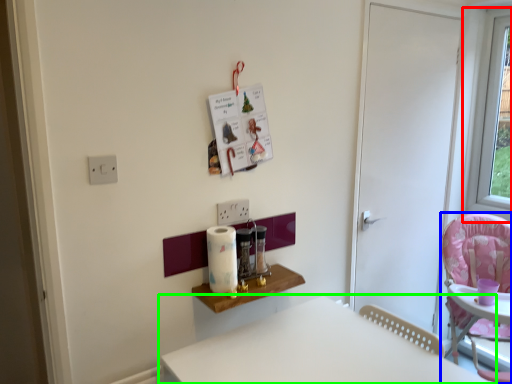
Question: Estimate the real-world distances between objects in this image. Which object is closer to window (highlighted by a red box), chair (highlighted by a blue box) or table (highlighted by a green box)?

Choices:
 (A) chair
 (B) table

Answer: (A)